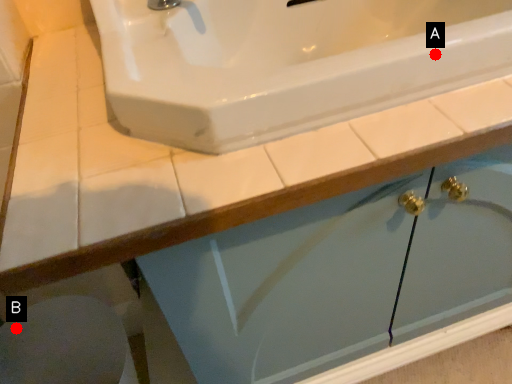
Question: Two points are circled on the image, labeled by A and B beside each circle. Which point appears farthest from the camera in this image?

Choices:
 (A) A is further
 (B) B is further

Answer: (B)